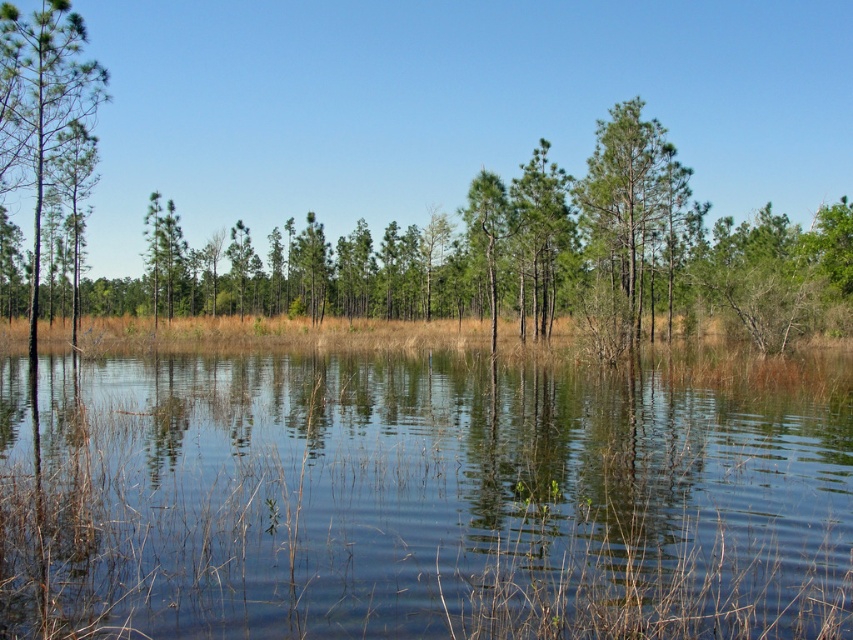
Consider the image. You are a bird flying over the wetland and want to land on the nearest tree. Which tree should you choose between the green matte tree at center and the green matte tree at left?

The green matte tree at left is closer to you than the green matte tree at center, so you should land on the green matte tree at left.

You are a hiker standing at the edge of the wetland and want to cross to the other side. You see the clear water at center and the green matte tree at left. Which one is closer to you?

The clear water at center is 17.23 meters away from the green matte tree at left, so the green matte tree at left is closer to you since it is only 17.23 meters away from the water which is in the center.

You are a photographer planning to capture the wetland scene. You want to ensure that both the clear water at center and the green matte tree at left are visible in your shot. Based on their sizes, which object will occupy more of the frame?

The clear water at center is larger in size than the green matte tree at left, so it will occupy more of the frame.